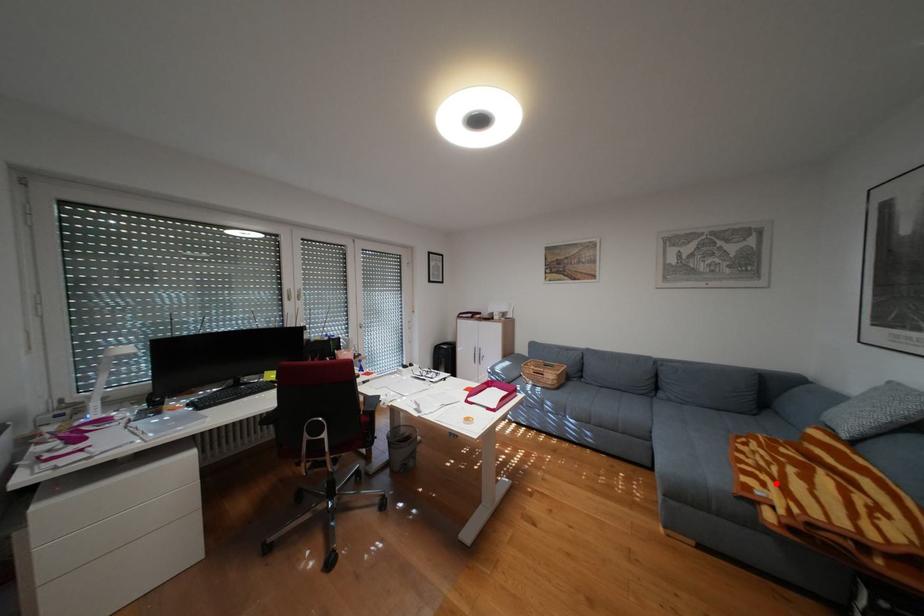
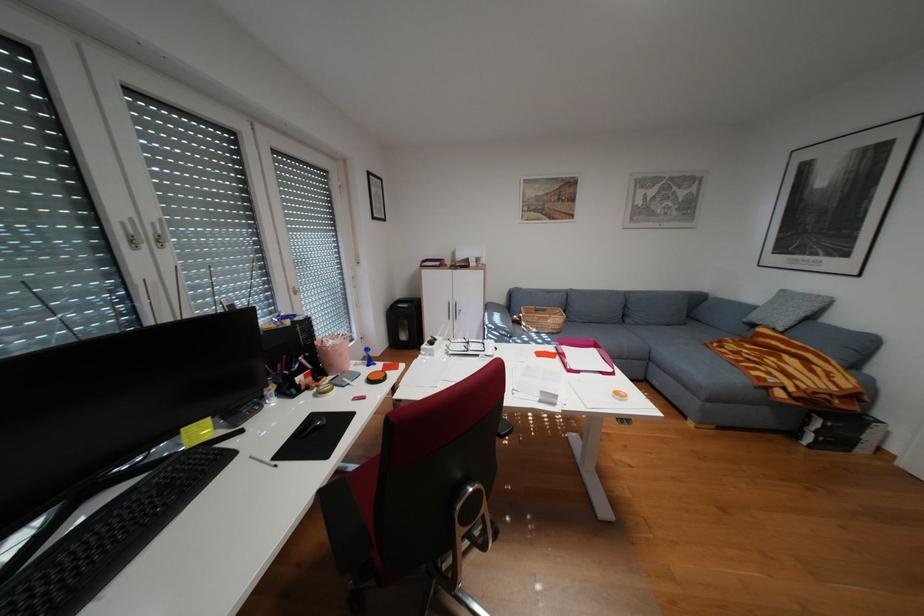
Where in the second image is the point corresponding to the highlighted location from the first image?

(782, 373)